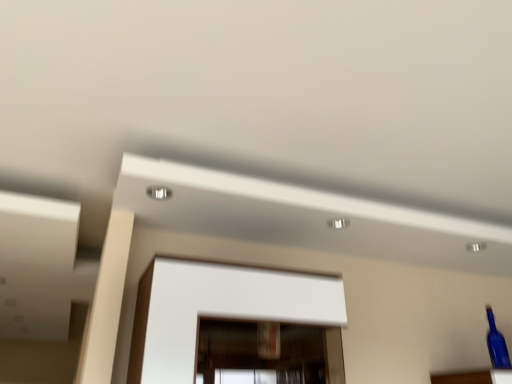
This screenshot has height=384, width=512. I want to click on blue glass bottle at lower right, so click(496, 344).

Describe the element at coordinates (496, 344) in the screenshot. I see `blue glass bottle at lower right` at that location.

The width and height of the screenshot is (512, 384). I want to click on blue glass bottle at lower right, so point(496,344).